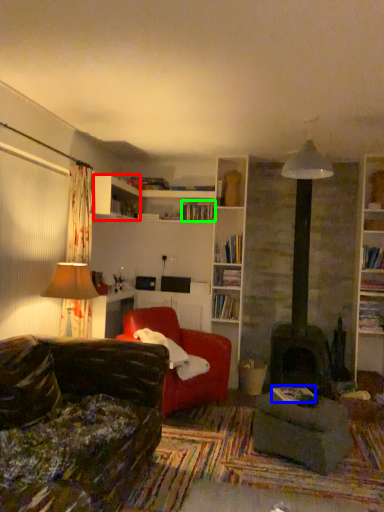
Question: Which is farther away from shelf (highlighted by a red box)? book (highlighted by a blue box) or book (highlighted by a green box)?

Choices:
 (A) book
 (B) book

Answer: (A)